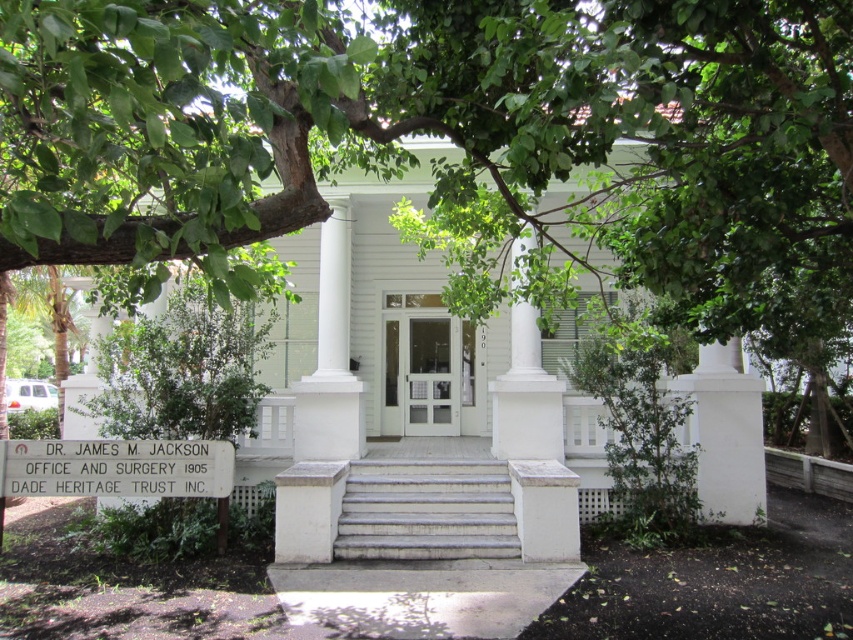
You are a delivery person carrying a large package that is 1.5 meters wide. You need to approach the entrance of the building. Can you pass through the area between the white marble stairs at center and the white smooth column at center without moving the package sideways?

The white marble stairs at center are wider than the white smooth column at center. Since the stairs are wider, there should be enough space for the 1.5 meter wide package to pass between them without needing to move it sideways.

Based on the photo, you are standing in front of the white building and looking at the entrance. There are two points marked on the image, point 1 at coordinates point (408,554) and point 2 at coordinates point (326,381). Which point is closer to you?

Point (408,554) is closer to the camera than point (326,381).

You are a visitor approaching the entrance of the building. You need to determine which object you will see first as you walk towards the entrance. According to the scene description, which one is closer to you when you arrive at the entrance? The white marble stairs at center or the white smooth column at center?

The white marble stairs at center is smaller than the white smooth column at center, so the white marble stairs at center is closer to you when you arrive at the entrance.